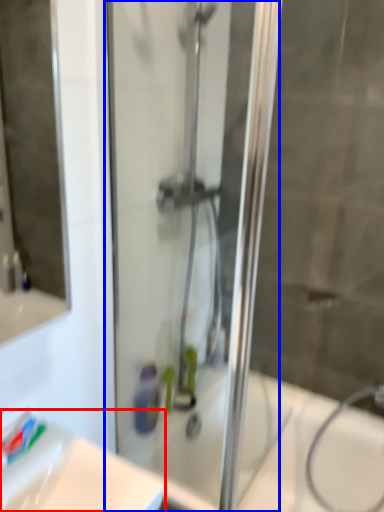
Question: Which point is closer to the camera, sink (highlighted by a red box) or screen door (highlighted by a blue box)?

Choices:
 (A) sink
 (B) screen door

Answer: (A)